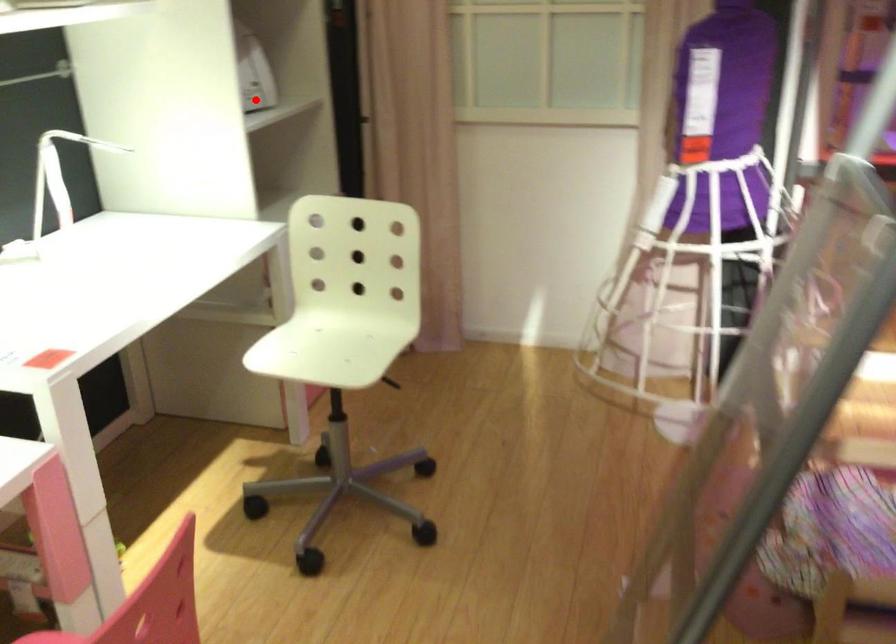
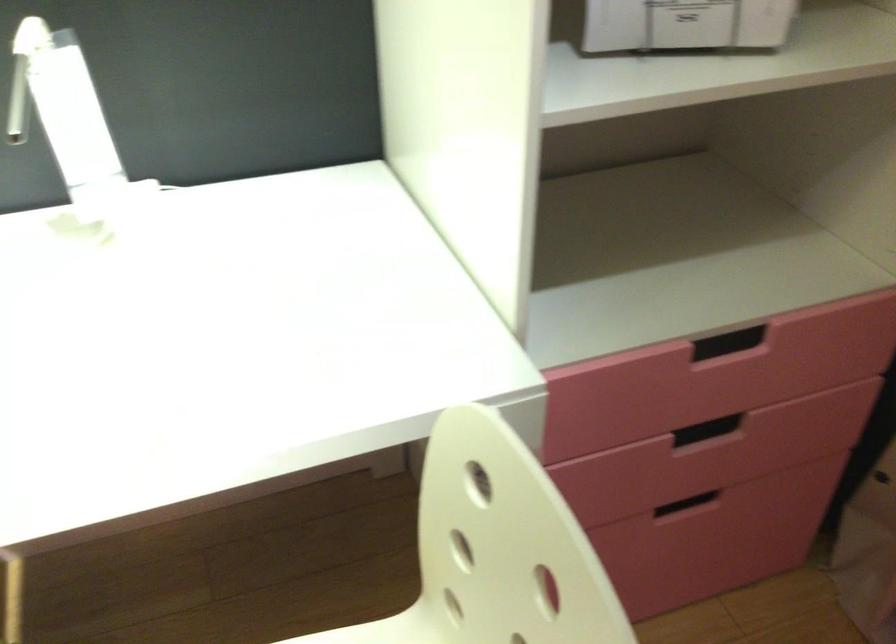
Question: I am providing you with two images of the same scene from different viewpoints. A red point is marked on the first image. Can you still see the location of the red point in image 2?

Choices:
 (A) Yes
 (B) No

Answer: (A)